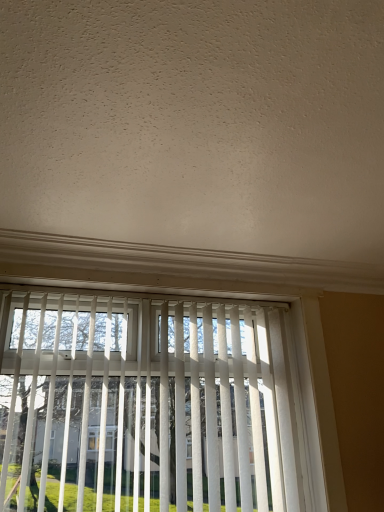
Where is `white plastic blinds at center`? The height and width of the screenshot is (512, 384). white plastic blinds at center is located at coordinates pyautogui.click(x=155, y=405).

The image size is (384, 512). What do you see at coordinates (155, 405) in the screenshot?
I see `white plastic blinds at center` at bounding box center [155, 405].

Locate an element on the screen. This screenshot has height=512, width=384. white plastic blinds at center is located at coordinates (155, 405).